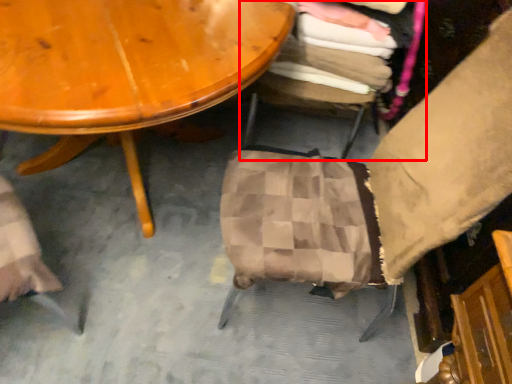
Question: Observing the image, what is the correct spatial positioning of chair (annotated by the red box) in reference to chair?

Choices:
 (A) left
 (B) right

Answer: (B)